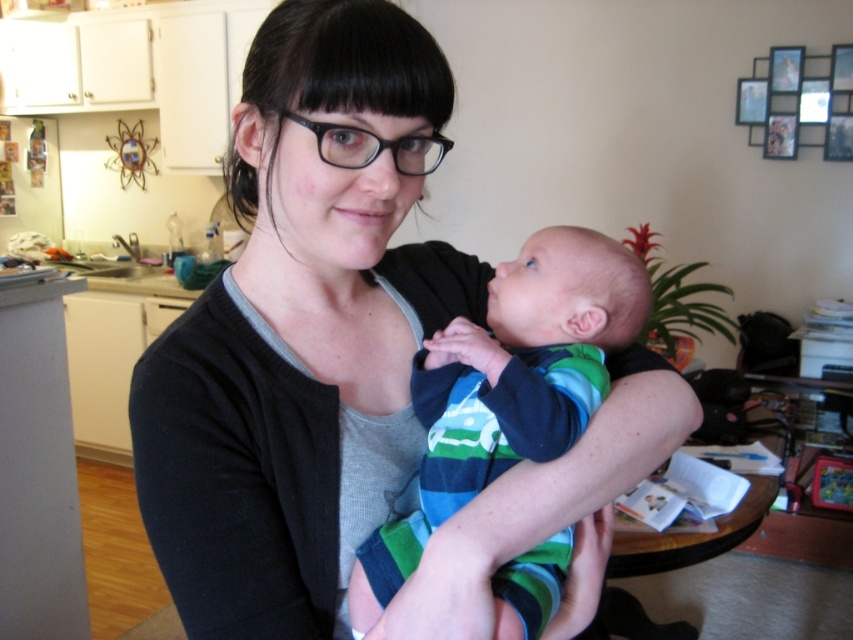
From the picture: Who is positioned more to the right, black matte cardigan at center or striped cotton onesie at center?

Positioned to the right is striped cotton onesie at center.

Between black matte cardigan at center and striped cotton onesie at center, which one appears on the left side from the viewer's perspective?

black matte cardigan at center

Does point (334, 566) come farther from viewer compared to point (556, 564)?

No, it is not.

Where is `black matte cardigan at center`? The image size is (853, 640). black matte cardigan at center is located at coordinates (299, 333).